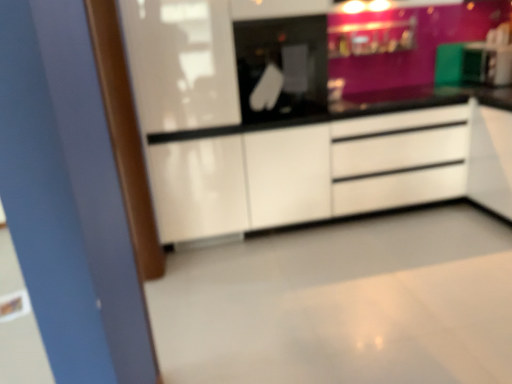
Question: Is black glass microwave at center positioned before white glossy chest of drawers at center?

Choices:
 (A) yes
 (B) no

Answer: (A)

Question: From the image's perspective, would you say black glass microwave at center is shown under white glossy chest of drawers at center?

Choices:
 (A) no
 (B) yes

Answer: (A)

Question: From the image's perspective, is black glass microwave at center on top of white glossy chest of drawers at center?

Choices:
 (A) no
 (B) yes

Answer: (B)

Question: From a real-world perspective, is black glass microwave at center on top of white glossy chest of drawers at center?

Choices:
 (A) yes
 (B) no

Answer: (A)

Question: Does black glass microwave at center have a smaller size compared to white glossy chest of drawers at center?

Choices:
 (A) no
 (B) yes

Answer: (B)

Question: Is black glass microwave at center facing away from white glossy chest of drawers at center?

Choices:
 (A) yes
 (B) no

Answer: (B)

Question: Can you confirm if white glossy chest of drawers at center is positioned to the right of black glass microwave at center?

Choices:
 (A) no
 (B) yes

Answer: (B)

Question: Is white glossy chest of drawers at center turned away from black glass microwave at center?

Choices:
 (A) no
 (B) yes

Answer: (A)

Question: Does white glossy chest of drawers at center have a smaller size compared to black glass microwave at center?

Choices:
 (A) no
 (B) yes

Answer: (A)

Question: From the image's perspective, is white glossy chest of drawers at center located beneath black glass microwave at center?

Choices:
 (A) no
 (B) yes

Answer: (B)

Question: Would you consider white glossy chest of drawers at center to be distant from black glass microwave at center?

Choices:
 (A) no
 (B) yes

Answer: (A)

Question: Is white glossy chest of drawers at center closer to camera compared to black glass microwave at center?

Choices:
 (A) no
 (B) yes

Answer: (A)

Question: From their relative heights in the image, would you say white glossy chest of drawers at center is taller or shorter than black glass microwave at center?

Choices:
 (A) tall
 (B) short

Answer: (A)